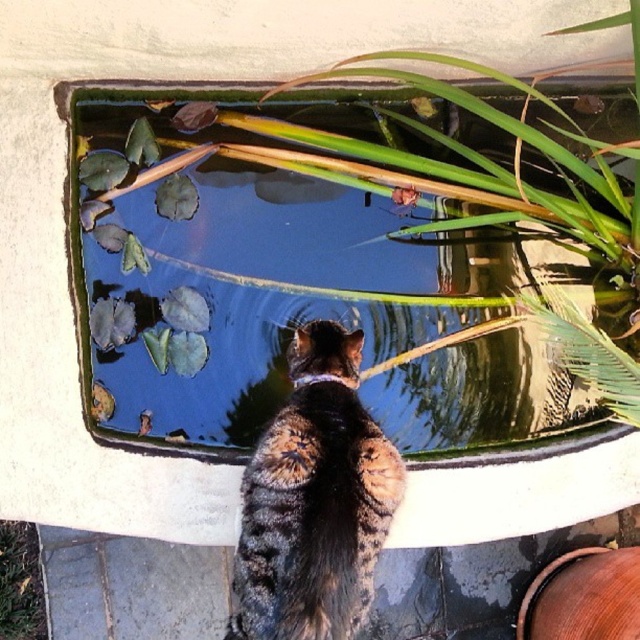
Question: Which point is closer to the camera?

Choices:
 (A) green leafy plant at upper center
 (B) green leafy plant at lower left
 (C) tabby fur cat at center

Answer: (C)

Question: Where is green leafy plant at upper center located in relation to tabby fur cat at center in the image?

Choices:
 (A) below
 (B) above

Answer: (B)

Question: Is green leafy plant at upper center to the left of tabby fur cat at center from the viewer's perspective?

Choices:
 (A) yes
 (B) no

Answer: (B)

Question: Where is green leafy plant at upper center located in relation to green leafy plant at lower left in the image?

Choices:
 (A) right
 (B) left

Answer: (A)

Question: Which is farther from the green leafy plant at lower left?

Choices:
 (A) green leafy plant at upper center
 (B) tabby fur cat at center

Answer: (B)

Question: Based on their relative distances, which object is nearer to the green leafy plant at upper center?

Choices:
 (A) green leafy plant at lower left
 (B) tabby fur cat at center

Answer: (B)